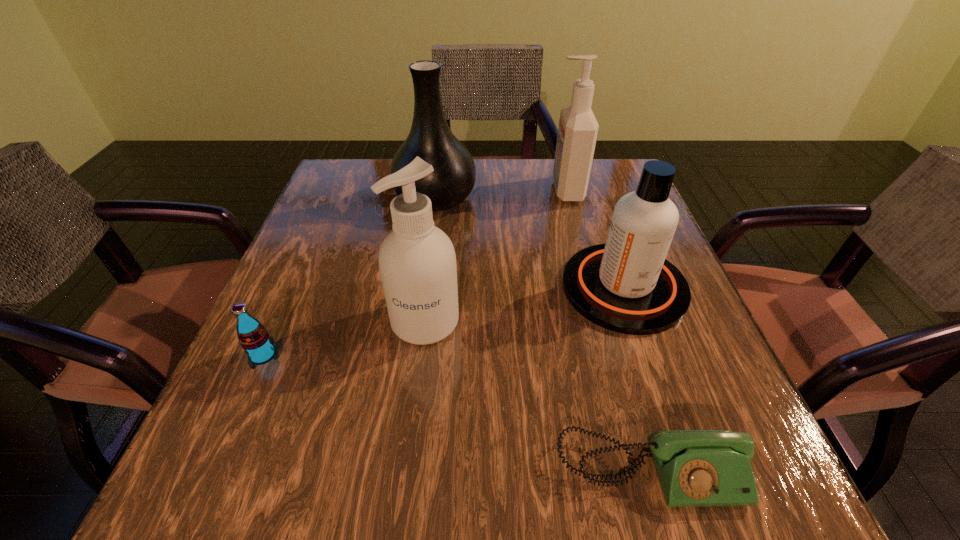
Find the location of `free space that is in between the leftmost cleansing agent and the nearest object`. free space that is in between the leftmost cleansing agent and the nearest object is located at coordinates (538, 396).

Locate an element on the screen. Image resolution: width=960 pixels, height=540 pixels. empty space that is in between the fourth tallest object and the vase is located at coordinates (530, 243).

Image resolution: width=960 pixels, height=540 pixels. Find the location of `free space between the farthest cleansing agent and the nearest object`. free space between the farthest cleansing agent and the nearest object is located at coordinates (609, 330).

The height and width of the screenshot is (540, 960). I want to click on free space between the shortest object and the vase, so (x=543, y=334).

The width and height of the screenshot is (960, 540). Identify the location of free area in between the vase and the telephone. (543, 334).

The image size is (960, 540). What are the coordinates of `vacant area that lies between the soda and the shortest object` in the screenshot? It's located at (457, 413).

Locate which object is the fourth closest to the shortest object. Please provide its 2D coordinates. Your answer should be formatted as a tuple, i.e. [(x, y)], where the tuple contains the x and y coordinates of a point satisfying the conditions above.

[(430, 138)]

Image resolution: width=960 pixels, height=540 pixels. In order to click on object that is the fourth closest to the second shortest object in this screenshot , I will do `click(627, 286)`.

Locate which cleansing agent is the third closest to the leftmost object. Please provide its 2D coordinates. Your answer should be formatted as a tuple, i.e. [(x, y)], where the tuple contains the x and y coordinates of a point satisfying the conditions above.

[(577, 133)]

Locate an element on the screen. cleansing agent identified as the closest to the shortest cleansing agent is located at coordinates (577, 133).